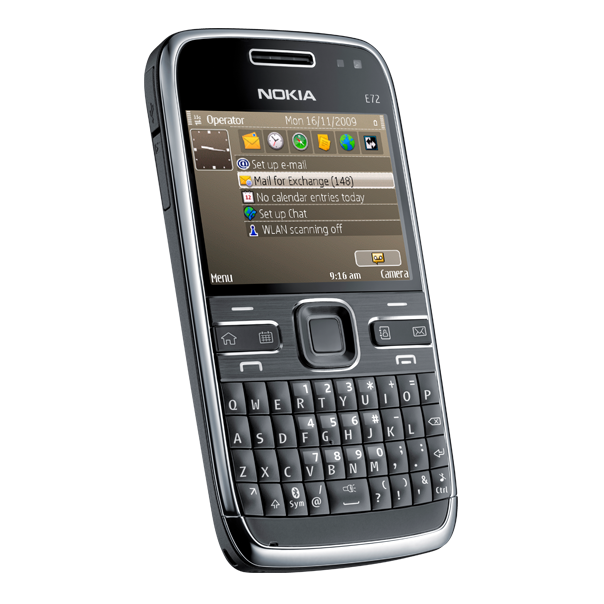
The height and width of the screenshot is (604, 604). Identify the location of phone. (200, 63).